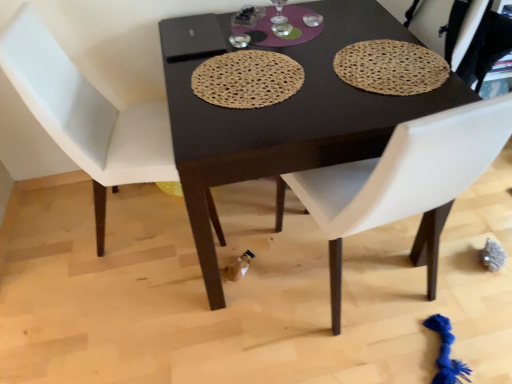
This screenshot has height=384, width=512. I want to click on free space in front of natural fiber placemat at center, the 1th mat when ordered from left to right, so click(270, 131).